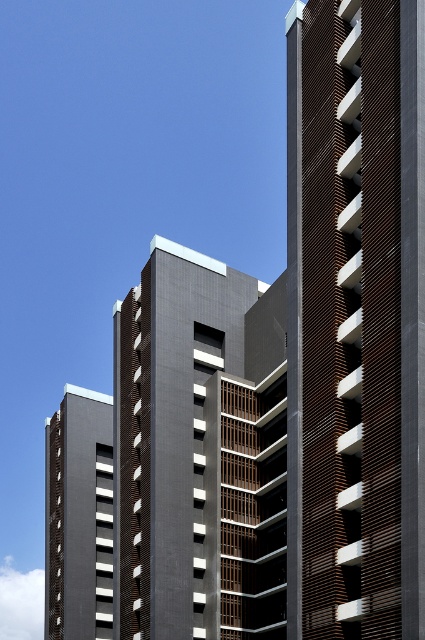
Question: Can you confirm if brown wooden slats at center is positioned below dark gray concrete building at center?

Choices:
 (A) yes
 (B) no

Answer: (B)

Question: Which object is positioned farthest from the dark gray concrete building at lower left?

Choices:
 (A) dark gray concrete building at center
 (B) brown wooden slats at center

Answer: (B)

Question: Estimate the real-world distances between objects in this image. Which object is closer to the dark gray concrete building at center?

Choices:
 (A) dark gray concrete building at lower left
 (B) brown wooden slats at center

Answer: (A)

Question: Is dark gray concrete building at center bigger than dark gray concrete building at lower left?

Choices:
 (A) yes
 (B) no

Answer: (A)

Question: Is brown wooden slats at center thinner than dark gray concrete building at center?

Choices:
 (A) yes
 (B) no

Answer: (A)

Question: Based on their relative distances, which object is nearer to the dark gray concrete building at center?

Choices:
 (A) brown wooden slats at center
 (B) dark gray concrete building at lower left

Answer: (B)